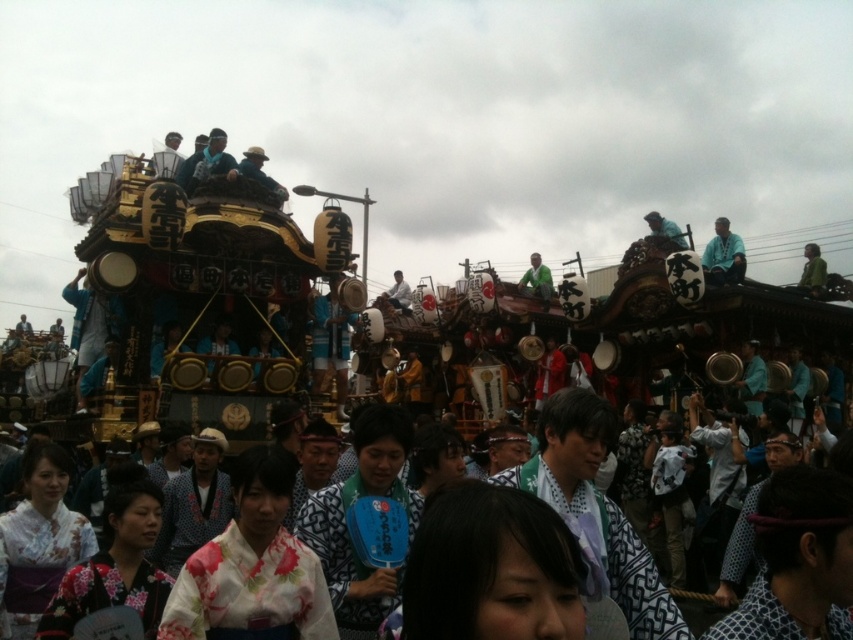
Question: Which of these objects is positioned farthest from the floral kimono at center?

Choices:
 (A) light blue fabric at upper right
 (B) green fabric at upper right
 (C) green fabric shirt at center

Answer: (B)

Question: Which point appears closest to the camera in this image?

Choices:
 (A) (396, 305)
 (B) (730, 241)
 (C) (544, 268)
 (D) (291, 561)

Answer: (D)

Question: Estimate the real-world distances between objects in this image. Which object is farther from the floral kimono at center?

Choices:
 (A) blue fabric hat at upper center
 (B) green fabric at upper right

Answer: (B)

Question: Is matte gold helmet at upper center positioned at the back of green fabric shirt at center?

Choices:
 (A) yes
 (B) no

Answer: (B)

Question: In this image, where is floral kimono at center located relative to matte gold helmet at upper center?

Choices:
 (A) right
 (B) left

Answer: (A)

Question: Is green fabric at upper right positioned behind green fabric shirt at center?

Choices:
 (A) no
 (B) yes

Answer: (A)